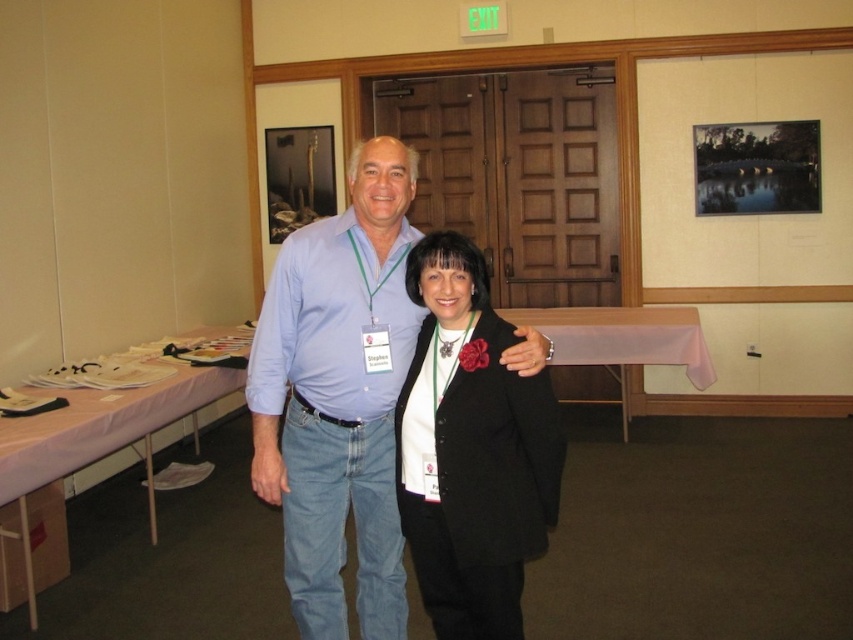
What are the coordinates of the light blue cotton shirt at center?

The coordinates of the light blue cotton shirt at center are at point (339, 396).

You are at a conference and need to identify two people based on their clothing. There is a light blue cotton shirt at center and a black woolen blazer at center. Which one is positioned to the left?

The light blue cotton shirt at center is to the left of the black woolen blazer at center.